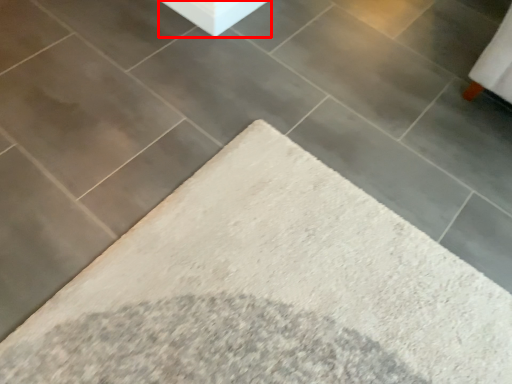
Question: Considering the relative positions of concrete (annotated by the red box) and furniture in the image provided, where is concrete (annotated by the red box) located with respect to the staircase?

Choices:
 (A) left
 (B) right

Answer: (B)